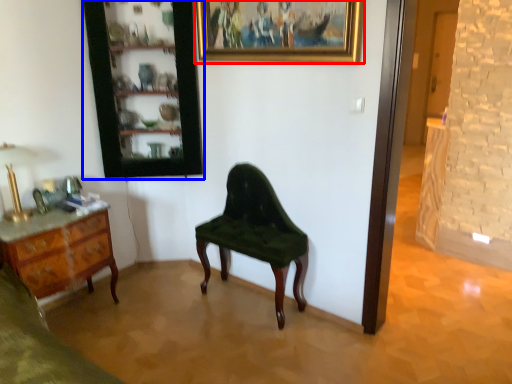
Question: Which of the following is the farthest to the observer, picture frame (highlighted by a red box) or cabinetry (highlighted by a blue box)?

Choices:
 (A) picture frame
 (B) cabinetry

Answer: (B)